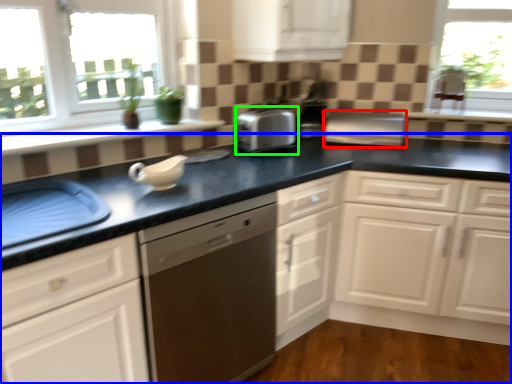
Question: Which object is positioned closest to appliance (highlighted by a red box)? Select from countertop (highlighted by a blue box) and home appliance (highlighted by a green box).

Choices:
 (A) countertop
 (B) home appliance

Answer: (A)